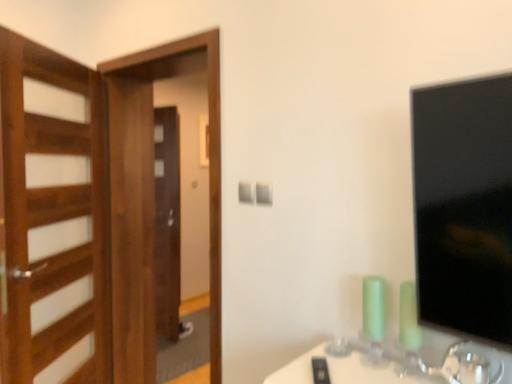
What do you see at coordinates (152, 197) in the screenshot? I see `wooden screen door at left` at bounding box center [152, 197].

In order to face wooden screen door at left, should I rotate leftwards or rightwards?

Rotate left and turn 9.062 degrees.

What is the approximate height of wooden screen door at left?

The height of wooden screen door at left is 2.10 meters.

I want to click on wooden screen door at left, so click(152, 197).

Find the location of `wooden door at left`. wooden door at left is located at coordinates (50, 215).

The width and height of the screenshot is (512, 384). What do you see at coordinates (50, 215) in the screenshot?
I see `wooden door at left` at bounding box center [50, 215].

The image size is (512, 384). Identify the location of wooden screen door at left. (152, 197).

Is wooden door at left at the left side of wooden screen door at left?

Indeed, wooden door at left is positioned on the left side of wooden screen door at left.

Is wooden door at left positioned before wooden screen door at left?

Yes, wooden door at left is closer to the viewer.

Considering the points (77, 201) and (100, 64), which point is in front, point (77, 201) or point (100, 64)?

Point (77, 201)

From the image's perspective, which is below, wooden door at left or wooden screen door at left?

wooden screen door at left appears lower in the image.

From a real-world perspective, which object rests below the other?

In real-world perspective, wooden screen door at left is lower.

Can you confirm if wooden door at left is thinner than wooden screen door at left?

Yes.

Does wooden door at left have a greater height compared to wooden screen door at left?

No.

Considering the sizes of wooden door at left and wooden screen door at left in the image, is wooden door at left bigger or smaller than wooden screen door at left?

Considering their sizes, wooden door at left takes up less space than wooden screen door at left.

Is wooden door at left not within wooden screen door at left?

wooden door at left lies outside wooden screen door at left's area.

Is wooden door at left positioned far away from wooden screen door at left?

No.

Is wooden door at left looking in the opposite direction of wooden screen door at left?

wooden door at left is not turned away from wooden screen door at left.

How many degrees apart are the facing directions of wooden door at left and wooden screen door at left?

The angle between the facing direction of wooden door at left and the facing direction of wooden screen door at left is 124 degrees.

Find the location of a particular element. screen door that appears behind the wooden door at left is located at coordinates (152, 197).

Does wooden screen door at left appear on the right side of wooden door at left?

Yes, wooden screen door at left is to the right of wooden door at left.

Which object is more forward, wooden screen door at left or wooden door at left?

Positioned in front is wooden door at left.

Which is closer to the camera, (x=128, y=153) or (x=102, y=102)?

Positioned in front is point (x=102, y=102).

Based on the photo, from the image's perspective, who appears lower, wooden screen door at left or wooden door at left?

wooden screen door at left appears lower in the image.

From a real-world perspective, is wooden screen door at left on top of wooden door at left?

Incorrect, from a real-world perspective, wooden screen door at left is lower than wooden door at left.

Can you confirm if wooden screen door at left is wider than wooden door at left?

Yes.

Who is taller, wooden screen door at left or wooden door at left?

With more height is wooden screen door at left.

Is wooden screen door at left smaller than wooden door at left?

No.

Is wooden screen door at left not within wooden door at left?

wooden screen door at left is positioned outside wooden door at left.

Is wooden screen door at left far from wooden door at left?

No.

Is wooden screen door at left turned away from wooden door at left?

Yes, wooden screen door at left is facing away from wooden door at left.

What's the angular difference between wooden screen door at left and wooden door at left's facing directions?

The facing directions of wooden screen door at left and wooden door at left are 124 degrees apart.

Measure the distance from wooden screen door at left to wooden door at left.

14.53 inches.

Locate an element on the screen. door in front of the wooden screen door at left is located at coordinates pos(50,215).

I want to click on screen door behind the wooden door at left, so click(152, 197).

The image size is (512, 384). I want to click on door above the wooden screen door at left (from a real-world perspective), so click(50, 215).